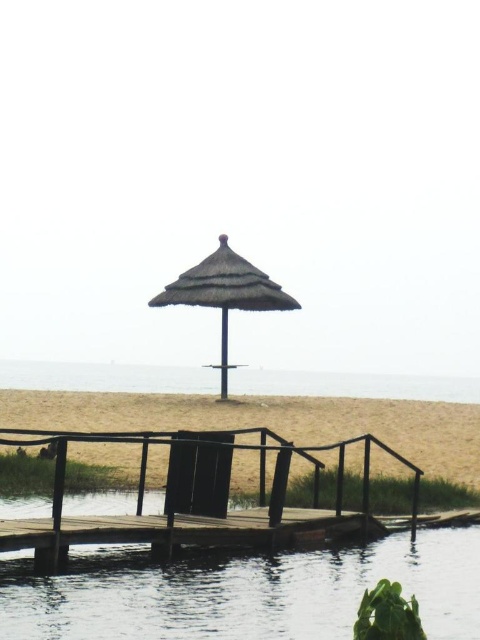
You are standing on the beach and want to walk from the thatched straw umbrella at center to the black woven beach chair at center. Which direction should you move in?

You should move away from the viewer because the black woven beach chair at center is further away than the thatched straw umbrella at center.

You are standing on the beach and want to walk towards the thatched roof umbrella at the end of the dock. You notice two points marked on the dock. Which point, point (140, 488) or point (171, 486), is closer to you as you start walking towards the umbrella?

Point (140, 488) is closer to you because it is further to the viewer than point (171, 486), meaning it is nearer to your starting position on the beach.